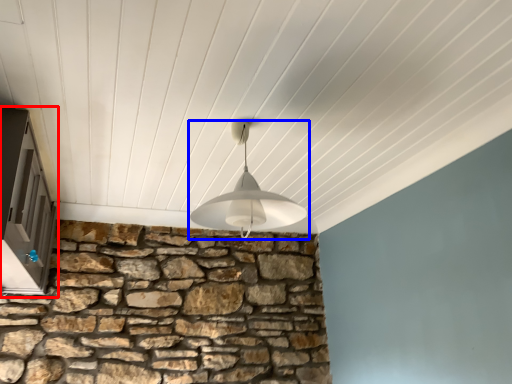
Question: Which object appears farthest to the camera in this image, window (highlighted by a red box) or lamp (highlighted by a blue box)?

Choices:
 (A) window
 (B) lamp

Answer: (B)